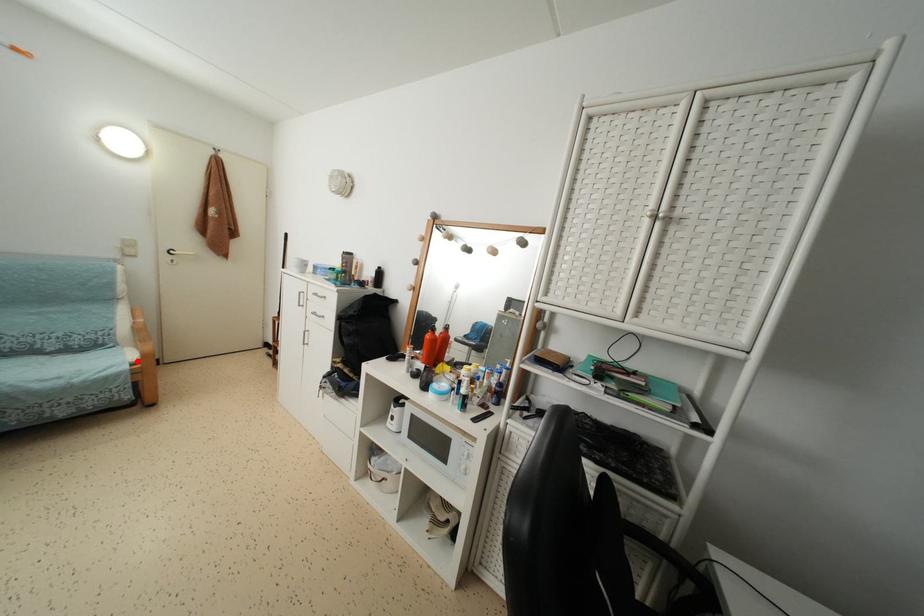
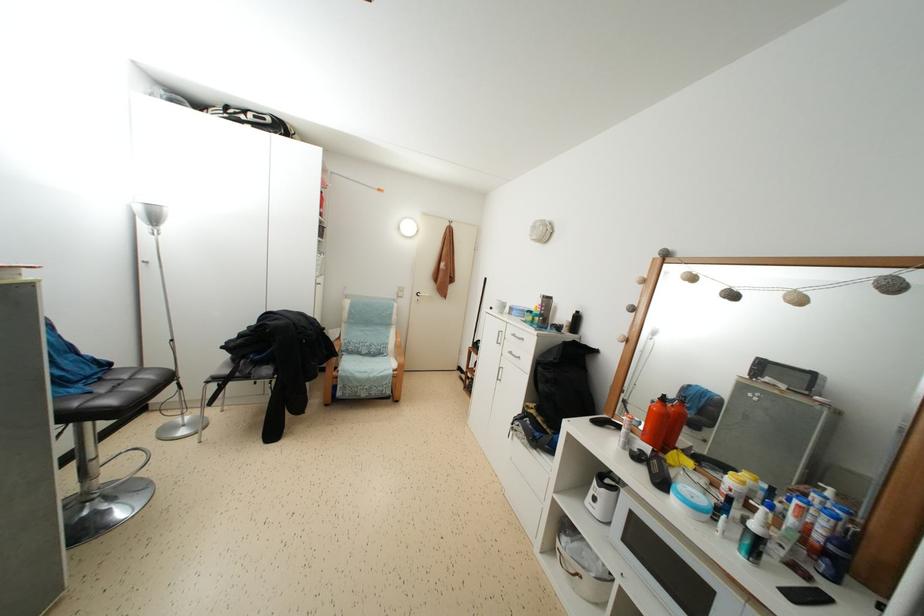
Question: I am providing you with two images of the same scene from different viewpoints. Given a red point in image1, look at the same physical point in image2. Is it:

Choices:
 (A) Closer to the viewpoint
 (B) Farther from the viewpoint

Answer: (B)